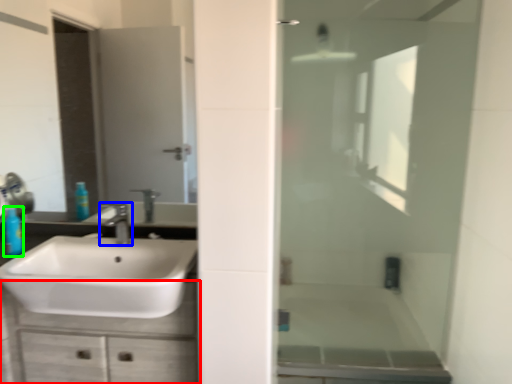
Question: Estimate the real-world distances between objects in this image. Which object is farther from bathroom cabinet (highlighted by a red box), tap (highlighted by a blue box) or toiletry (highlighted by a green box)?

Choices:
 (A) tap
 (B) toiletry

Answer: (B)